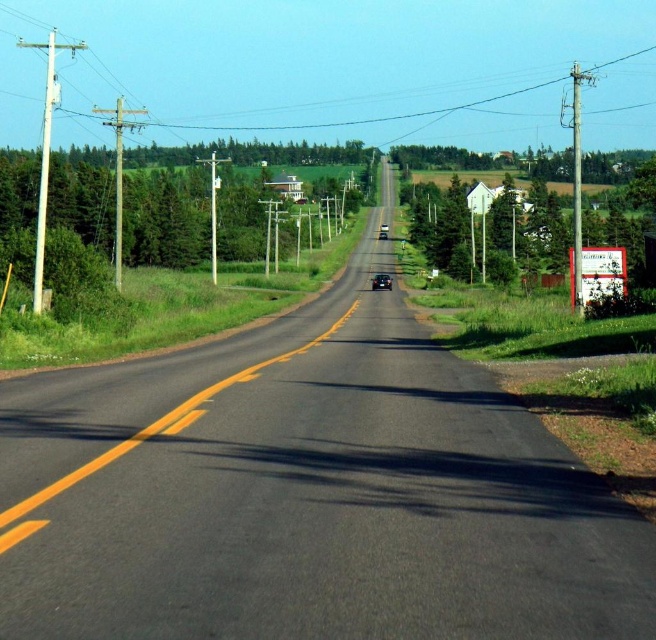
Who is positioned more to the right, green leafy tree at right or shiny black car at center?

green leafy tree at right

Does point (529, 220) lie behind point (379, 273)?

No, it is not.

Identify the location of green leafy tree at right. The height and width of the screenshot is (640, 656). (487, 227).